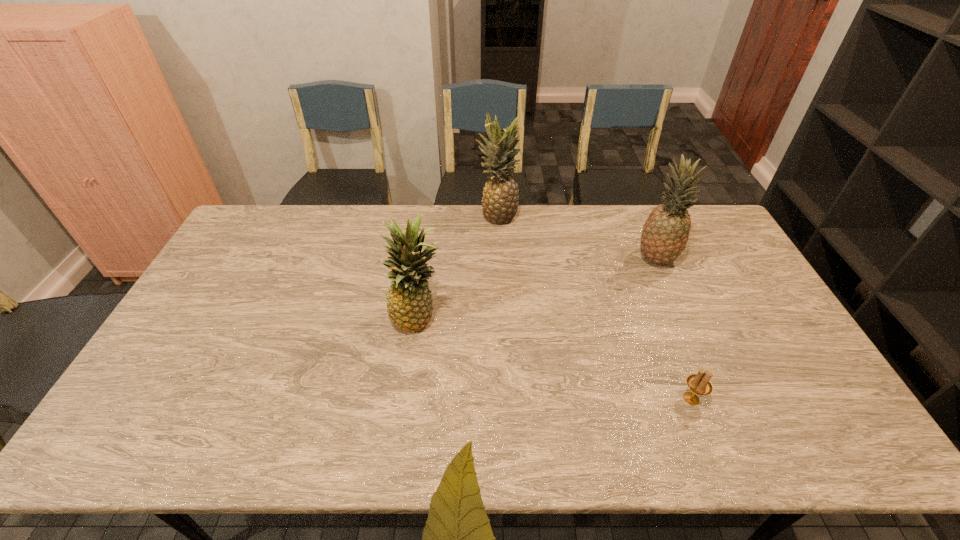
This screenshot has width=960, height=540. What are the coordinates of `vacant area that lies between the second nearest object and the rightmost pineapple` in the screenshot? It's located at (538, 289).

Find the location of a particular element. This screenshot has width=960, height=540. free space between the second pineapple from left to right and the candle holder is located at coordinates (594, 308).

The height and width of the screenshot is (540, 960). What are the coordinates of `vacant area that lies between the rightmost pineapple and the candle holder` in the screenshot? It's located at (674, 329).

Locate an element on the screen. The width and height of the screenshot is (960, 540). vacant space in between the second object from left to right and the shortest object is located at coordinates (594, 308).

Identify the location of free spot between the rightmost pineapple and the third farthest object. This screenshot has width=960, height=540. (538, 289).

The width and height of the screenshot is (960, 540). Identify the location of vacant space in between the third nearest object and the second pineapple from right to left. (577, 238).

Where is `unoccupied area between the third object from right to left and the nearest object`? This screenshot has width=960, height=540. unoccupied area between the third object from right to left and the nearest object is located at coordinates (594, 308).

You are a GUI agent. You are given a task and a screenshot of the screen. Output one action in this format:
    pyautogui.click(x=<x>, y=<y>)
    Task: Click on the vacant point located between the second nearest object and the nearest object
    This screenshot has height=540, width=960.
    Given the screenshot: What is the action you would take?
    point(555,359)

Locate an element on the screen. The height and width of the screenshot is (540, 960). vacant point located between the third object from right to left and the second farthest pineapple is located at coordinates coord(577,238).

I want to click on free space between the shortest object and the leftmost pineapple, so click(555, 359).